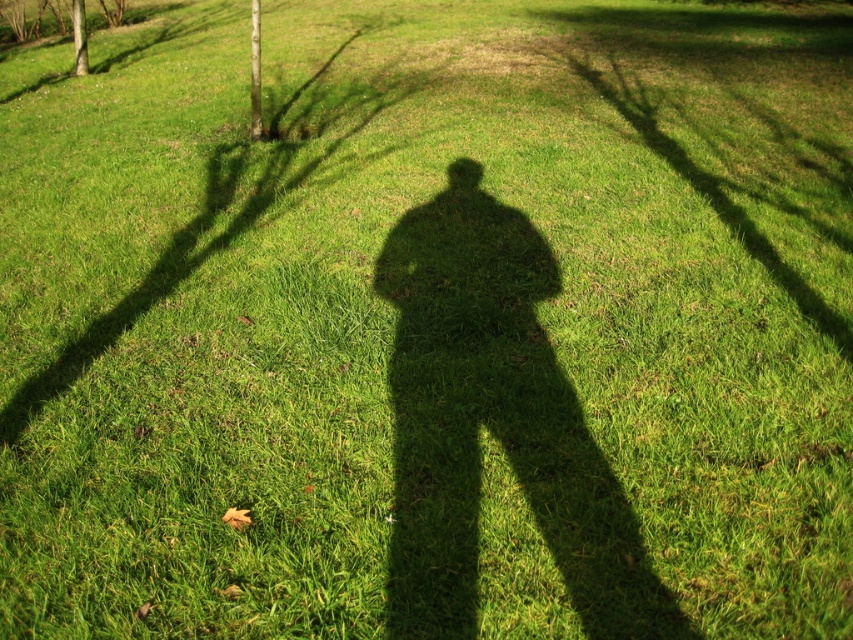
Looking at this image, does green leafy tree at upper left have a lesser width compared to smooth brown tree trunk at upper left?

No.

Does point (259, 93) come behind point (76, 22)?

No, (259, 93) is in front of (76, 22).

Where is `green leafy tree at upper left`? The width and height of the screenshot is (853, 640). green leafy tree at upper left is located at coordinates (254, 72).

Locate an element on the screen. This screenshot has width=853, height=640. green leafy tree at upper left is located at coordinates (254, 72).